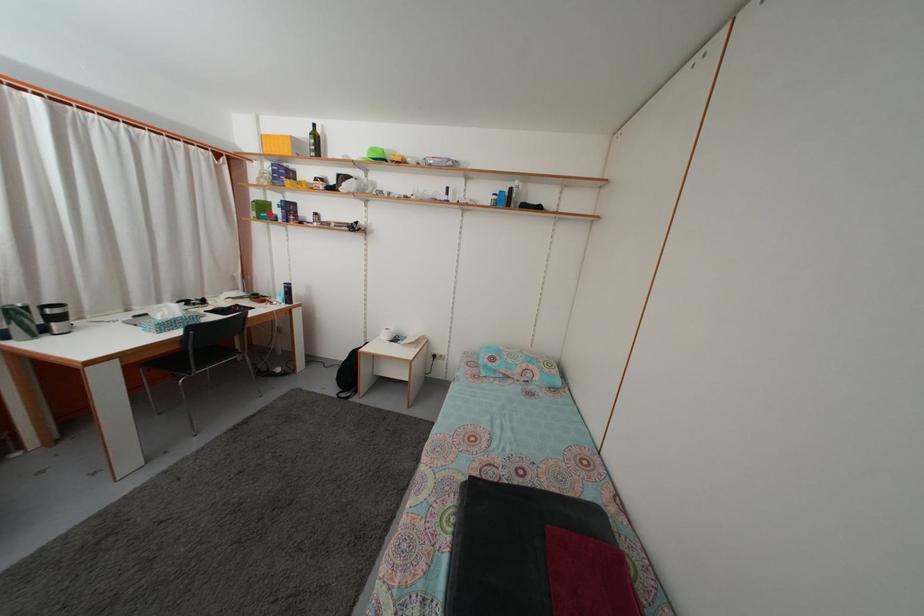
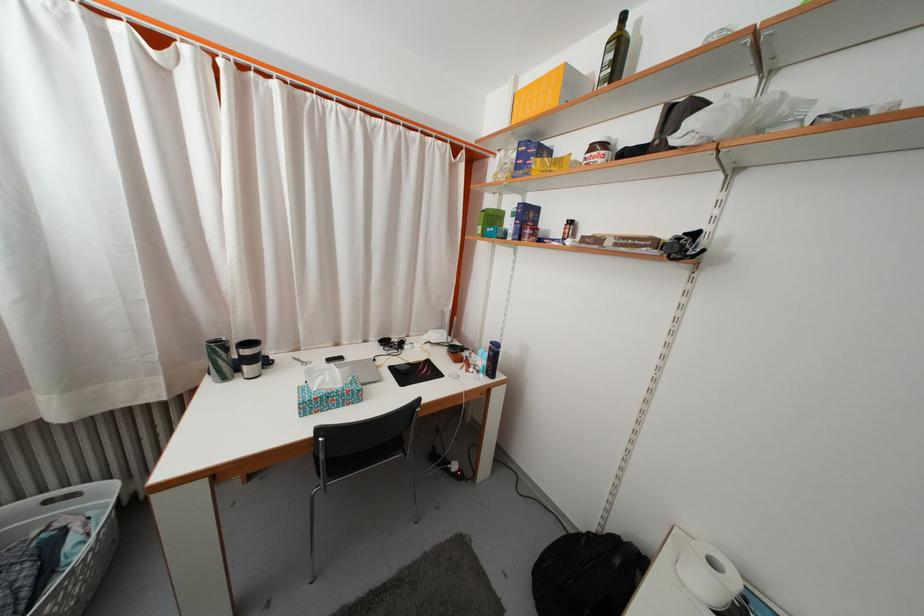
Locate, in the second image, the point that corresponds to the highlighted location in the first image.

(500, 225)